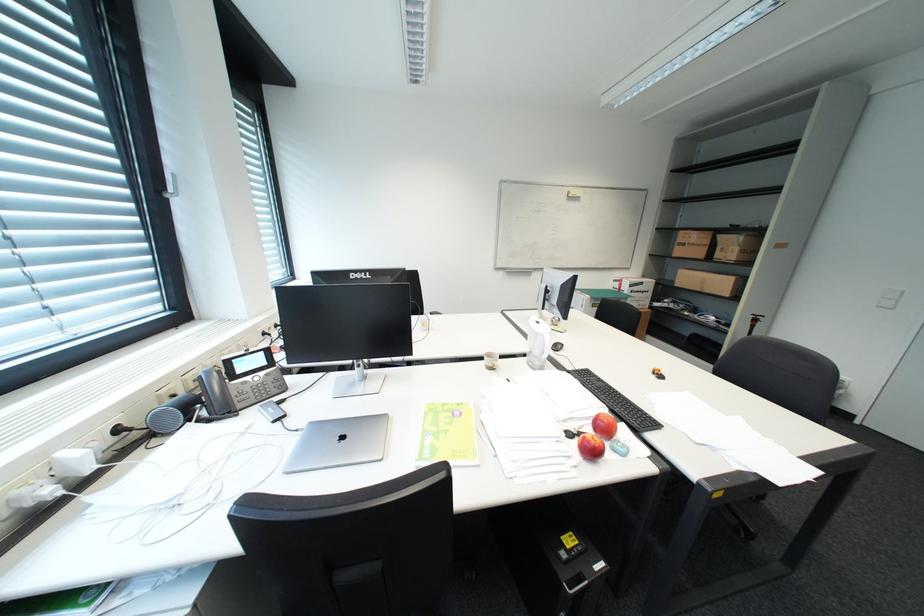
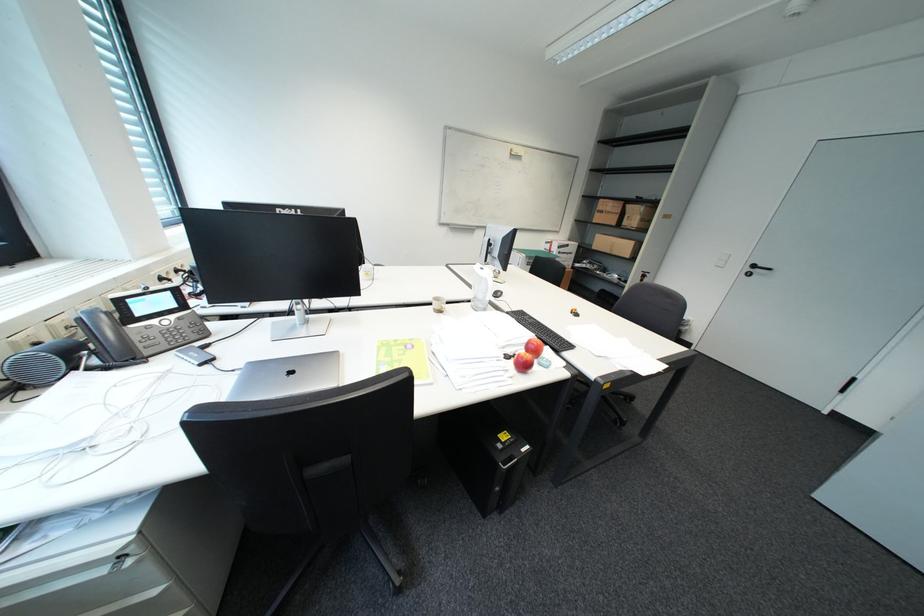
Question: The first image is from the beginning of the video and the second image is from the end. How did the camera likely rotate when shooting the video?

Choices:
 (A) Left
 (B) Right
 (C) Up
 (D) Down

Answer: (B)